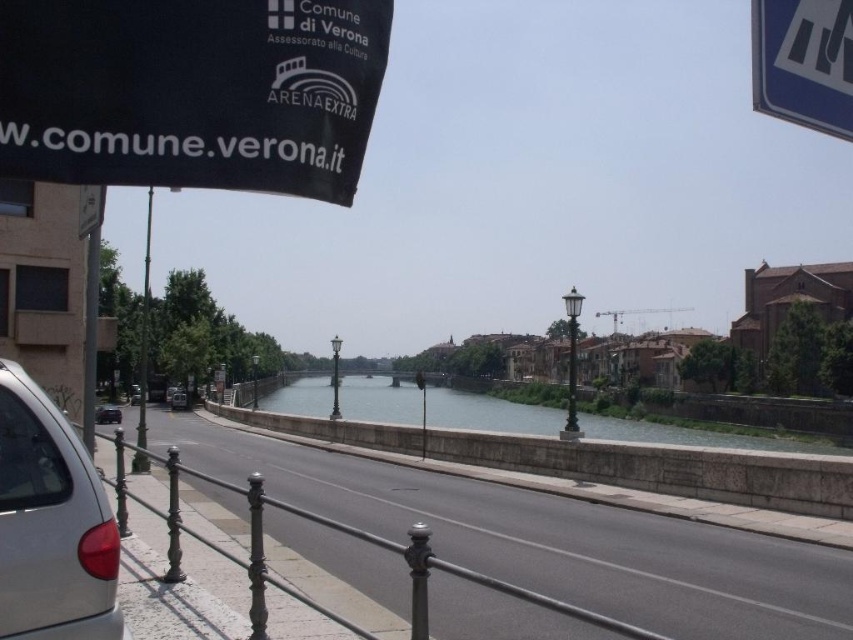
Question: Is blue plastic sign at upper right further to camera compared to white plastic sign at upper left?

Choices:
 (A) yes
 (B) no

Answer: (B)

Question: Is satin silver car at left to the left of black metal pole at center from the viewer's perspective?

Choices:
 (A) no
 (B) yes

Answer: (B)

Question: Which point is closer to the camera?

Choices:
 (A) (71, 513)
 (B) (520, 429)

Answer: (A)

Question: Which of the following is the farthest from the observer?

Choices:
 (A) click(108, 412)
 (B) click(572, 428)

Answer: (A)

Question: Can you confirm if green metallic pole at left is smaller than silver metallic car at left?

Choices:
 (A) no
 (B) yes

Answer: (A)

Question: Considering the real-world distances, which object is closest to the white plastic sign at upper left?

Choices:
 (A) metallic gray railing at lower left
 (B) satin silver car at left
 (C) green metallic pole at left
 (D) blue plastic sign at upper right

Answer: (B)